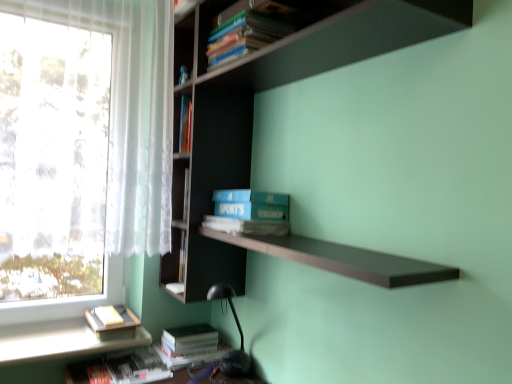
Where is `vacant space to the left of hardcover book at lower left, the third book in the top-to-bottom sequence`? Image resolution: width=512 pixels, height=384 pixels. vacant space to the left of hardcover book at lower left, the third book in the top-to-bottom sequence is located at coordinates (67, 333).